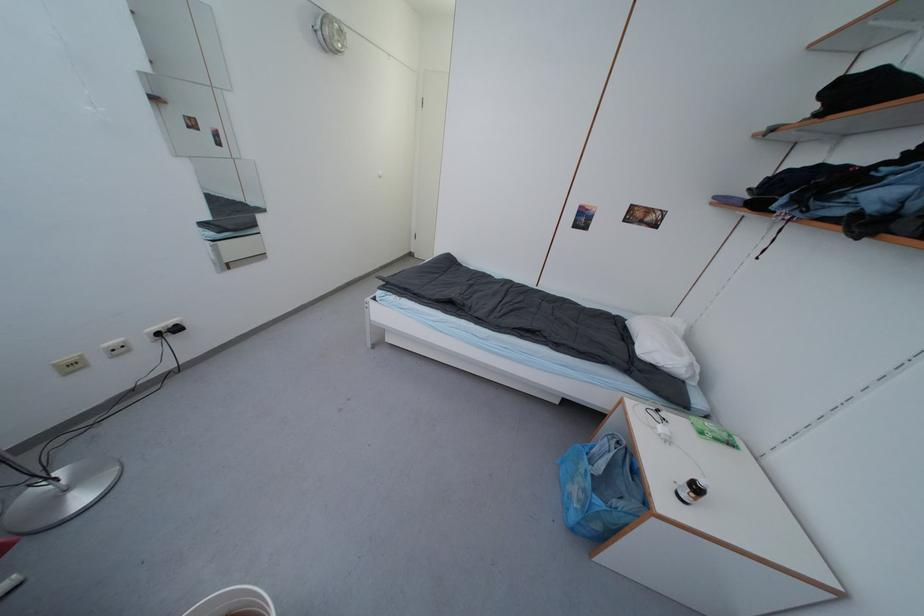
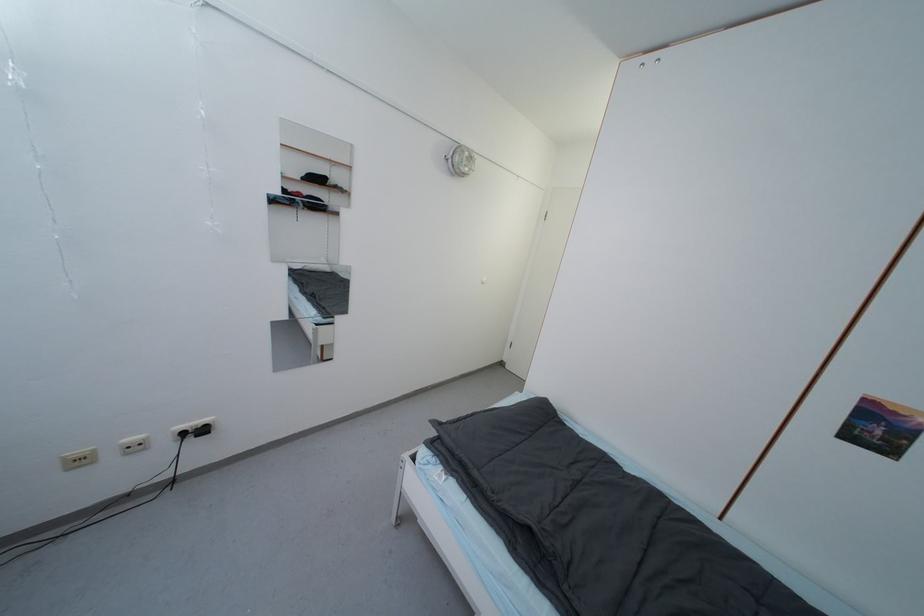
The images are taken continuously from a first-person perspective. In which direction is your viewpoint rotating?

→ The rotation direction of the camera is left-up.